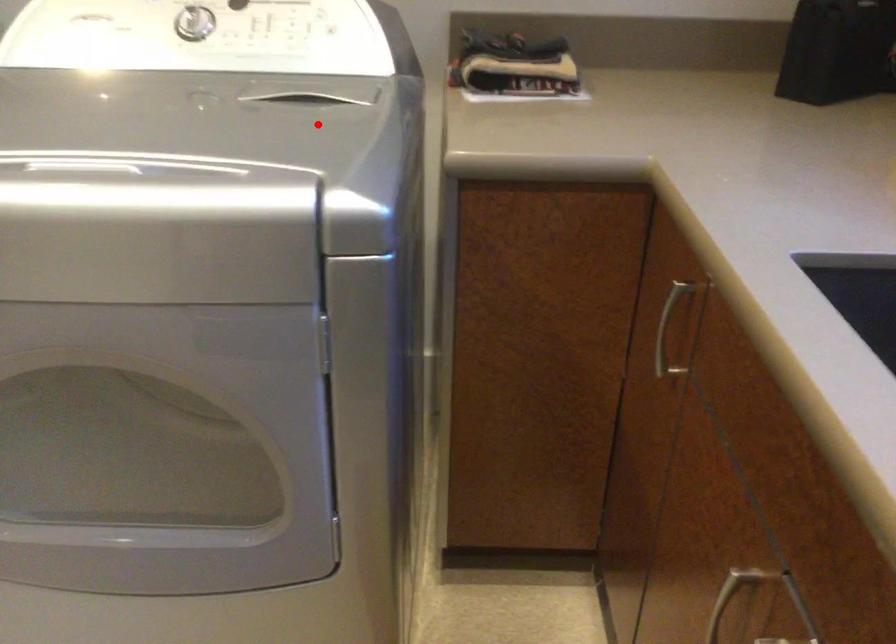
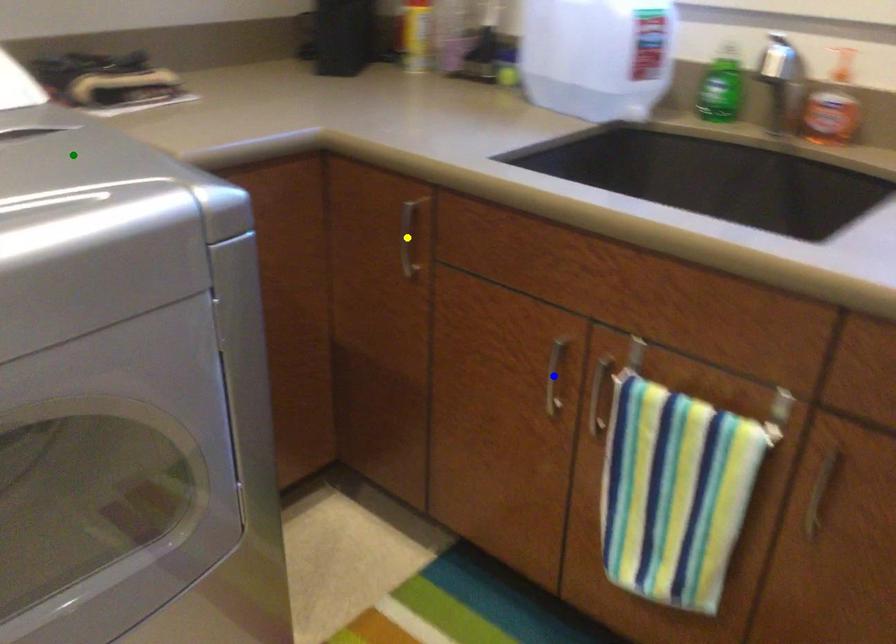
Question: I am providing you with two images of the same scene from different viewpoints. A red point is marked on the first image. You are given multiple points on the second image. Which spot in image 2 lines up with the point in image 1?

Choices:
 (A) green point
 (B) blue point
 (C) yellow point

Answer: (A)